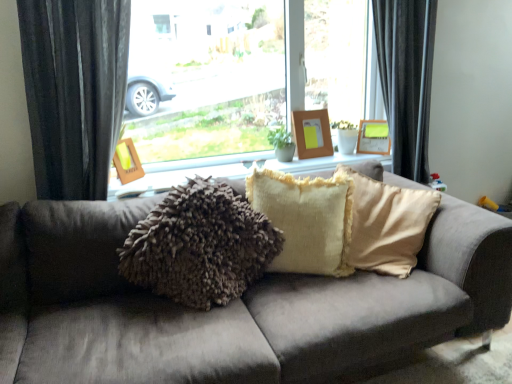
Question: From the image's perspective, would you say wooden picture frame at upper center, positioned as the 3th picture frame in front-to-back order, is positioned over woodenwoodenpicture frame at left, which appears as the 1th picture frame when viewed from the left?

Choices:
 (A) no
 (B) yes

Answer: (B)

Question: Is wooden picture frame at upper center, positioned as the first picture frame in right-to-left order, not within woodenwoodenpicture frame at left, the third picture frame from the right?

Choices:
 (A) no
 (B) yes

Answer: (B)

Question: Is wooden picture frame at upper center, the third picture frame in the left-to-right sequence, positioned far away from woodenwoodenpicture frame at left, the third picture frame viewed from the back?

Choices:
 (A) yes
 (B) no

Answer: (A)

Question: Considering the relative sizes of wooden picture frame at upper center, positioned as the 3th picture frame in front-to-back order, and woodenwoodenpicture frame at left, the third picture frame from the right, in the image provided, is wooden picture frame at upper center, positioned as the 3th picture frame in front-to-back order, taller than woodenwoodenpicture frame at left, the third picture frame from the right,?

Choices:
 (A) yes
 (B) no

Answer: (B)

Question: Is the depth of wooden picture frame at upper center, positioned as the first picture frame in right-to-left order, less than that of woodenwoodenpicture frame at left, which appears as the 1th picture frame when viewed from the left?

Choices:
 (A) no
 (B) yes

Answer: (A)

Question: Is wooden picture frame at upper center, positioned as the 1th picture frame in back-to-front order, beside woodenwoodenpicture frame at left, the third picture frame from the right?

Choices:
 (A) yes
 (B) no

Answer: (B)

Question: Is wooden picture frame at upper center, positioned as the 1th picture frame in back-to-front order, far from velvet dark gray curtain at left?

Choices:
 (A) yes
 (B) no

Answer: (A)

Question: From a real-world perspective, is wooden picture frame at upper center, positioned as the 3th picture frame in front-to-back order, below velvet dark gray curtain at left?

Choices:
 (A) yes
 (B) no

Answer: (A)

Question: Does wooden picture frame at upper center, positioned as the first picture frame in right-to-left order, have a greater width compared to velvet dark gray curtain at left?

Choices:
 (A) no
 (B) yes

Answer: (A)

Question: Can you confirm if wooden picture frame at upper center, positioned as the first picture frame in right-to-left order, is positioned to the right of velvet dark gray curtain at left?

Choices:
 (A) yes
 (B) no

Answer: (A)

Question: Is wooden picture frame at upper center, positioned as the first picture frame in right-to-left order, next to velvet dark gray curtain at left and touching it?

Choices:
 (A) no
 (B) yes

Answer: (A)

Question: Considering the relative sizes of wooden picture frame at upper center, positioned as the 1th picture frame in back-to-front order, and velvet dark gray curtain at left in the image provided, is wooden picture frame at upper center, positioned as the 1th picture frame in back-to-front order, bigger than velvet dark gray curtain at left?

Choices:
 (A) no
 (B) yes

Answer: (A)

Question: Does fuzzy beige pillow at center have a larger size compared to fuzzy fabric pillows at center?

Choices:
 (A) yes
 (B) no

Answer: (A)